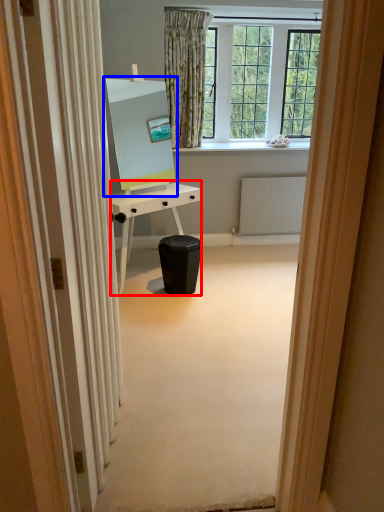
Question: Which of the following is the farthest to the observer, desk (highlighted by a red box) or computer monitor (highlighted by a blue box)?

Choices:
 (A) desk
 (B) computer monitor

Answer: (A)